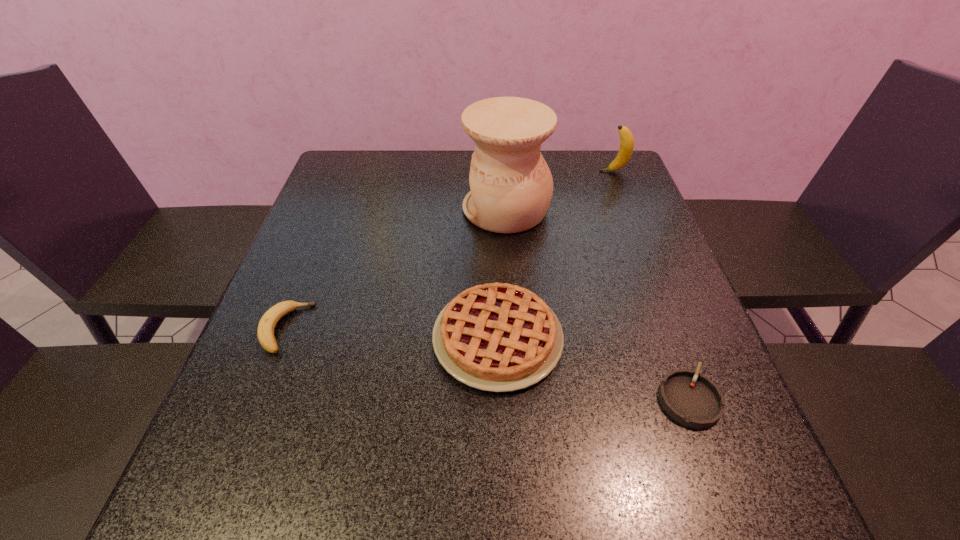
What are the coordinates of `vacant space situated 0.180m at the open side of the second farthest object` in the screenshot? It's located at (396, 209).

This screenshot has height=540, width=960. Identify the location of free spot located from the stem of the second tallest object. (545, 171).

In order to click on free point located from the stem of the second tallest object in this screenshot , I will do `click(481, 171)`.

Locate an element on the screen. vacant region located from the stem of the second tallest object is located at coordinates (569, 171).

Identify the location of vacant area located on the right of the third tallest object. Image resolution: width=960 pixels, height=540 pixels. (618, 338).

Find the location of a particular element. vacant space located on the front of the left banana is located at coordinates (254, 408).

Image resolution: width=960 pixels, height=540 pixels. Identify the location of free location located 0.080m on the back of the ashtray. (665, 335).

Image resolution: width=960 pixels, height=540 pixels. Identify the location of pottery located at the far edge. pyautogui.click(x=511, y=185).

At what (x,y) coordinates should I click in order to perform the action: click on banana present at the far edge. Please return your answer as a coordinate pair (x, y). Image resolution: width=960 pixels, height=540 pixels. Looking at the image, I should click on (626, 148).

At what (x,y) coordinates should I click in order to perform the action: click on object that is at the left edge. Please return your answer as a coordinate pair (x, y). This screenshot has height=540, width=960. Looking at the image, I should click on (266, 326).